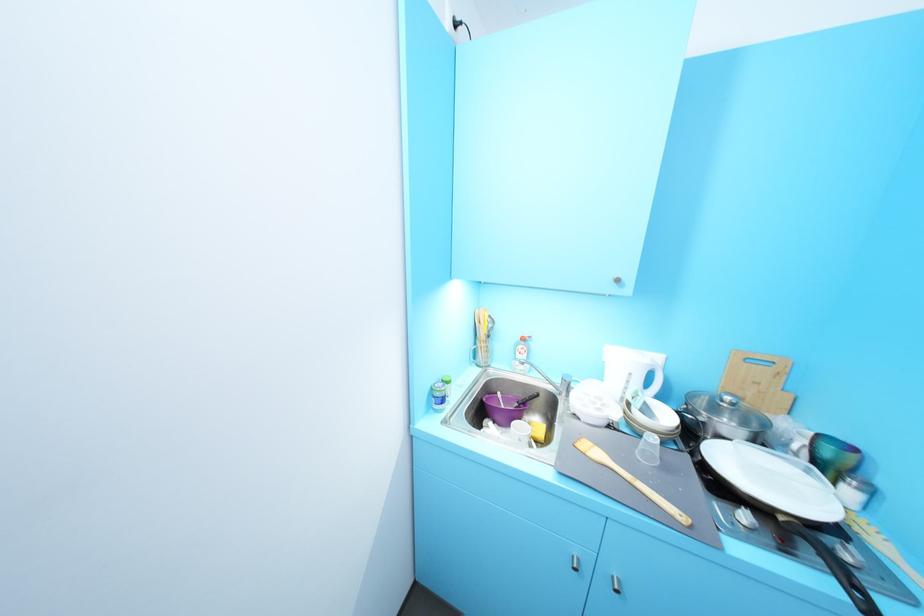
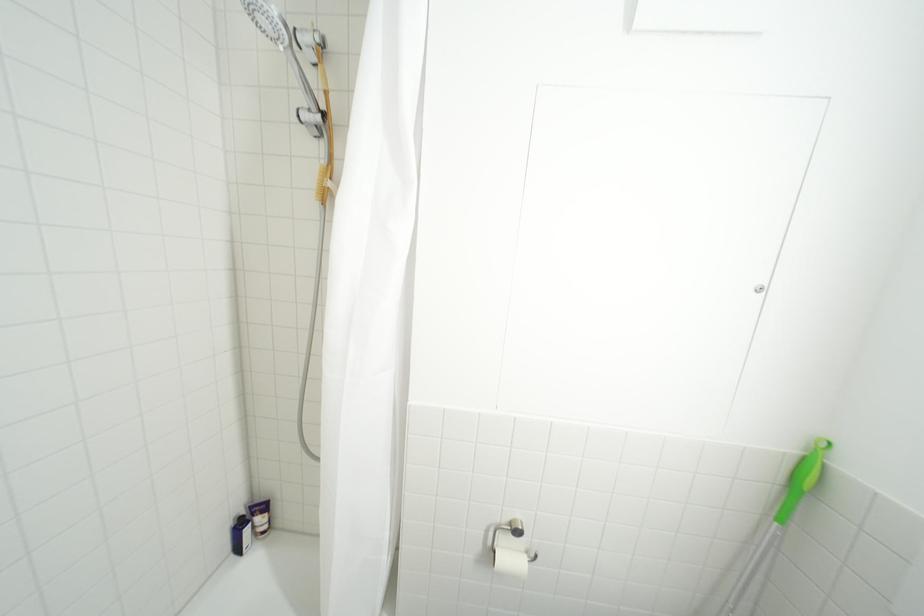
In a continuous first-person perspective shot, in which direction is the camera moving?

The cameraman walked toward left, forward.